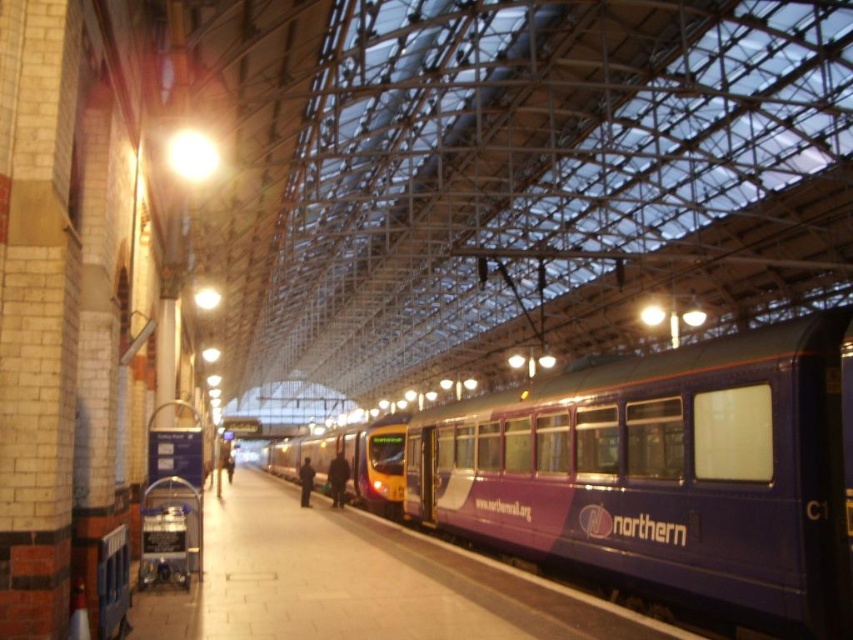
You are a photographer standing on the platform and want to capture both the purple glossy train at center and the dark blue jacket at platform center in a single photo. Since you can adjust your camera angle, which object should you focus on first to ensure both are in frame?

The purple glossy train at center is larger in size than the dark blue jacket at platform center, so you should focus on the purple glossy train at center first to ensure both fit within the frame.

You are a passenger waiting on the train station platform. You see a purple glossy train at center and a dark blue fabric jacket at center. Which object is taller?

The purple glossy train at center is taller than the dark blue fabric jacket at center.